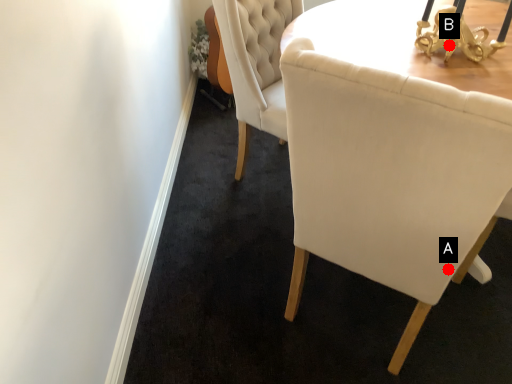
Question: Two points are circled on the image, labeled by A and B beside each circle. Among these points, which one is nearest to the camera?

Choices:
 (A) A is closer
 (B) B is closer

Answer: (A)